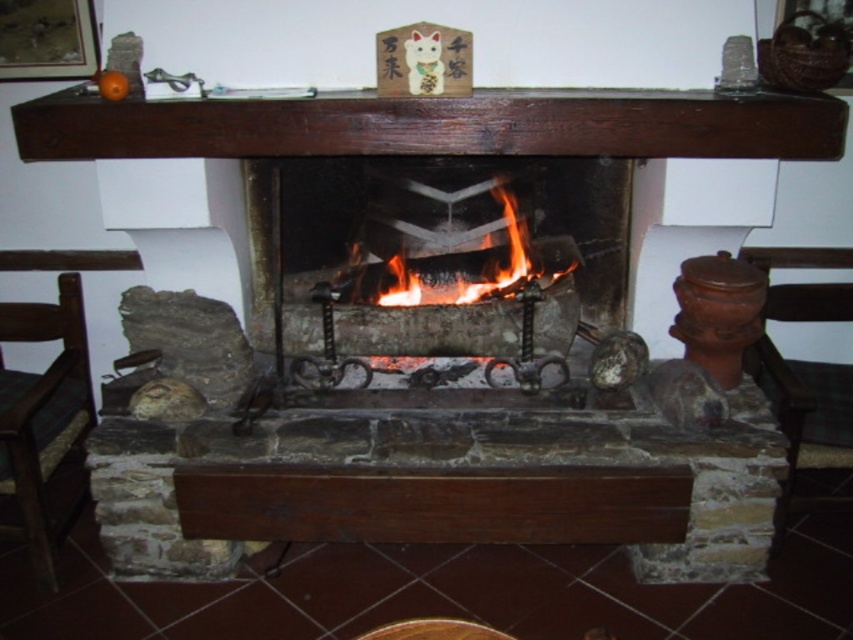
Question: Which object is the farthest from the charcoal stone fireplace at center?

Choices:
 (A) dark brown wood at upper center
 (B) green fabric chair at lower left
 (C) flaming wood at center

Answer: (B)

Question: Can you confirm if charcoal stone fireplace at center is positioned to the right of green fabric chair at lower left?

Choices:
 (A) no
 (B) yes

Answer: (B)

Question: Which object is farther from the camera taking this photo?

Choices:
 (A) green fabric chair at lower left
 (B) flaming wood at center

Answer: (B)

Question: Observing the image, what is the correct spatial positioning of charcoal stone fireplace at center in reference to dark brown wood at upper center?

Choices:
 (A) above
 (B) below

Answer: (B)

Question: Which point is farther to the camera?

Choices:
 (A) flaming wood at center
 (B) green fabric chair at lower left
 (C) dark brown wood at upper center
 (D) charcoal stone fireplace at center

Answer: (A)

Question: Is dark brown wood at upper center further to camera compared to flaming wood at center?

Choices:
 (A) yes
 (B) no

Answer: (B)